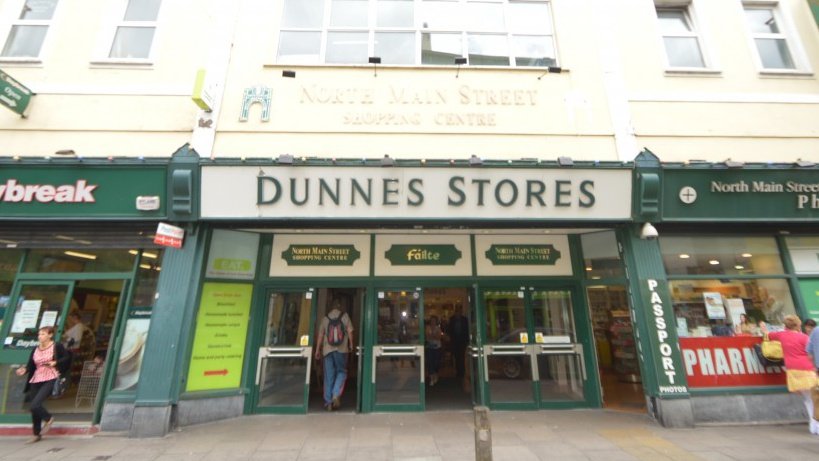
At what (x,y) coordinates should I click in order to perform the action: click on doors. Please return your answer as a coordinate pair (x, y). The image size is (819, 461). Looking at the image, I should click on (274, 388), (397, 393), (504, 383), (555, 386).